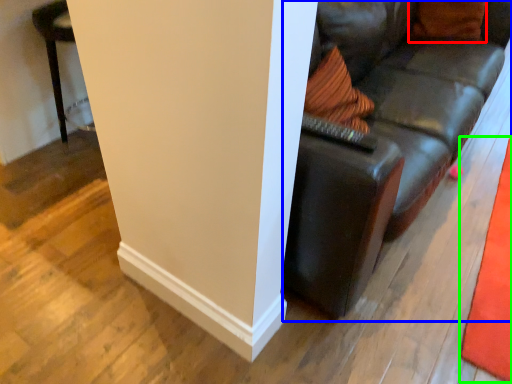
Question: Considering the real-world distances, which object is farthest from pillow (highlighted by a red box)? studio couch (highlighted by a blue box) or mat (highlighted by a green box)?

Choices:
 (A) studio couch
 (B) mat

Answer: (B)